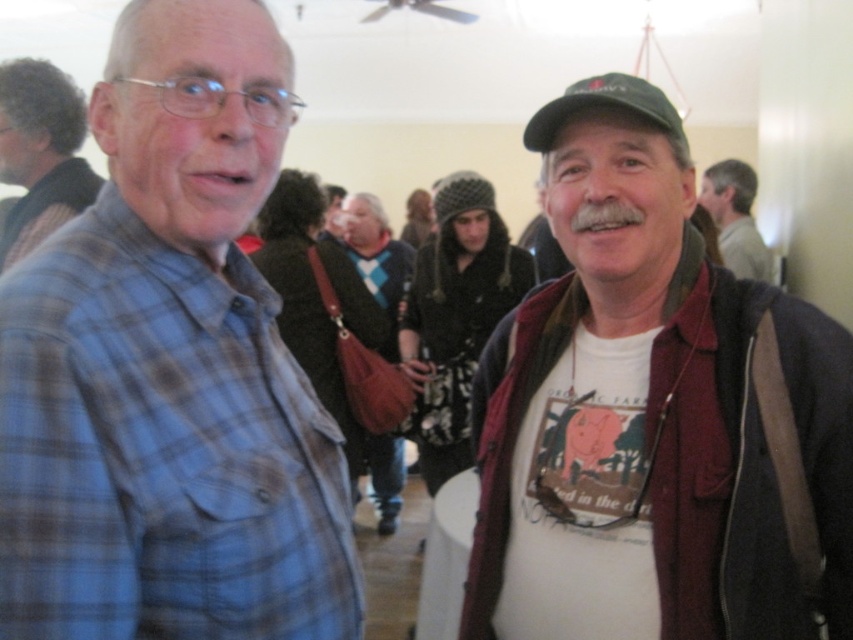
Question: Observing the image, what is the correct spatial positioning of matte green cap at center in reference to brown leather bag at center?

Choices:
 (A) above
 (B) below

Answer: (B)

Question: Is blue plaid shirt at left positioned in front of matte green cap at center?

Choices:
 (A) no
 (B) yes

Answer: (B)

Question: Can you confirm if matte black jacket at center is smaller than gray knit cap at upper right?

Choices:
 (A) yes
 (B) no

Answer: (B)

Question: Which is nearer to the brown leather bag at center?

Choices:
 (A) blue plaid shirt at left
 (B) gray plaid shirt at left
 (C) gray knit cap at upper right

Answer: (B)

Question: Which is farther from the blue plaid shirt at left?

Choices:
 (A) matte green cap at center
 (B) matte black jacket at center

Answer: (B)

Question: Which point is farther to the camera?

Choices:
 (A) (224, 188)
 (B) (618, 188)
 (C) (355, 262)
 (D) (268, 262)

Answer: (C)